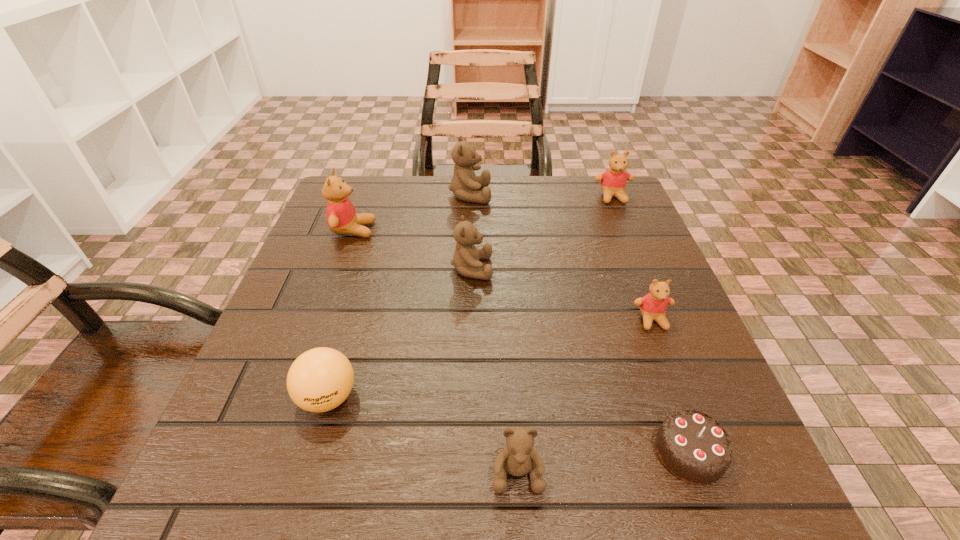
Locate an element on the screen. This screenshot has height=540, width=960. vacant area that lies between the shortest object and the biggest brown teddy bear is located at coordinates (580, 323).

Identify the location of vacant area that lies between the third farthest object and the nearest brown teddy bear. Image resolution: width=960 pixels, height=540 pixels. (436, 351).

Find the location of `free point between the nearest teddy bear and the leftmost teddy bear`. free point between the nearest teddy bear and the leftmost teddy bear is located at coordinates (436, 351).

Locate an element on the screen. The width and height of the screenshot is (960, 540). free space between the farthest brown teddy bear and the second biggest red teddy bear is located at coordinates (541, 196).

I want to click on vacant area between the nearest red teddy bear and the ping-pong ball, so click(x=490, y=359).

Where is `object identified as the second closest to the nearest teddy bear`? object identified as the second closest to the nearest teddy bear is located at coordinates (319, 380).

Identify which object is located as the fourth nearest to the farthest red teddy bear. Please provide its 2D coordinates. Your answer should be formatted as a tuple, i.e. [(x, y)], where the tuple contains the x and y coordinates of a point satisfying the conditions above.

[(341, 216)]

The image size is (960, 540). I want to click on teddy bear identified as the closest to the shortest object, so tap(518, 458).

I want to click on teddy bear identified as the sixth closest to the chocolate chocolate cake, so (x=341, y=216).

Where is `the second closest brown teddy bear to the farthest brown teddy bear`? The width and height of the screenshot is (960, 540). the second closest brown teddy bear to the farthest brown teddy bear is located at coordinates (518, 458).